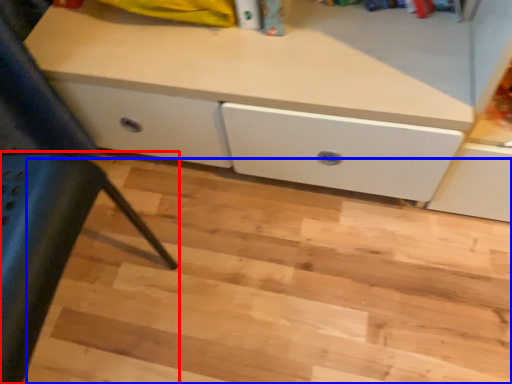
Question: Which object appears closest to the camera in this image, furniture (highlighted by a red box) or stair (highlighted by a blue box)?

Choices:
 (A) furniture
 (B) stair

Answer: (A)